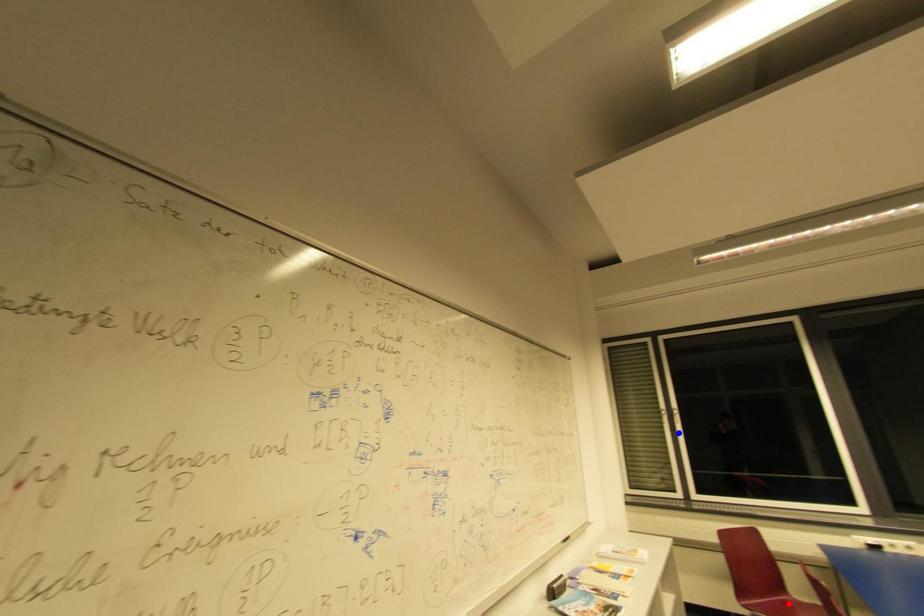
Question: Two points are marked on the image. Which point is closer to the camera?

Choices:
 (A) Blue point is closer.
 (B) Red point is closer.

Answer: (B)